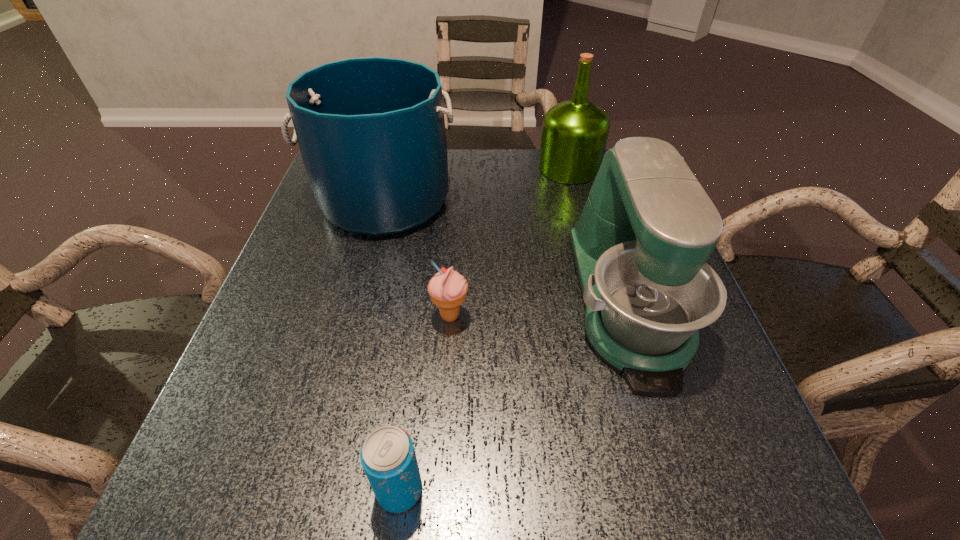
Find the location of `vacant region at the right edge of the desktop`. vacant region at the right edge of the desktop is located at coordinates (712, 413).

The height and width of the screenshot is (540, 960). In the image, there is a desktop. Find the location of `vacant space at the far right corner`. vacant space at the far right corner is located at coordinates (585, 197).

Locate an element on the screen. The width and height of the screenshot is (960, 540). free space between the mixer and the icecream is located at coordinates (539, 309).

Where is `free space between the olive oil and the icecream`? This screenshot has width=960, height=540. free space between the olive oil and the icecream is located at coordinates (510, 242).

What are the coordinates of `vacant area that lies between the soda can and the mixer` in the screenshot? It's located at (514, 396).

I want to click on free space between the mixer and the bucket, so click(x=506, y=252).

Where is `free spot between the mixer and the bucket`? free spot between the mixer and the bucket is located at coordinates (506, 252).

What are the coordinates of `free space between the icecream and the mixer` in the screenshot? It's located at (539, 309).

I want to click on free space between the icecream and the mixer, so click(539, 309).

The image size is (960, 540). In order to click on unoccupied area between the bucket and the nearest object in this screenshot , I will do `click(392, 345)`.